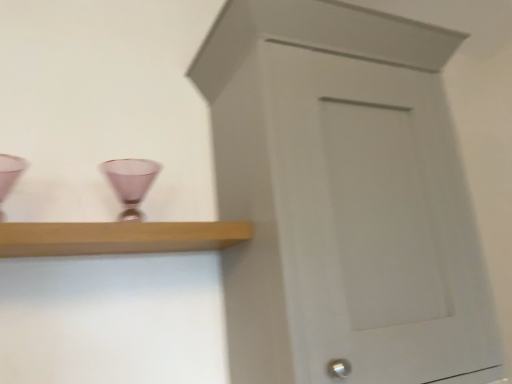
The height and width of the screenshot is (384, 512). Describe the element at coordinates (118, 237) in the screenshot. I see `light wood shelf at upper left` at that location.

I want to click on white painted wood cupboard at center, so point(343,198).

Locate an element on the screen. light wood shelf at upper left is located at coordinates (118, 237).

Is light wood shelf at upper left facing away from matte pink glass at center?

No, matte pink glass at center is not at the back of light wood shelf at upper left.

Considering the points (86, 229) and (112, 176), which point is behind, point (86, 229) or point (112, 176)?

The point (112, 176) is more distant.

Is light wood shelf at upper left located outside matte pink glass at center?

Yes.

How much distance is there between white painted wood cupboard at center and light wood shelf at upper left?

32.18 centimeters.

Consider the image. Which object is wider, white painted wood cupboard at center or light wood shelf at upper left?

Wider between the two is white painted wood cupboard at center.

Which of these two, white painted wood cupboard at center or light wood shelf at upper left, stands shorter?

Standing shorter between the two is light wood shelf at upper left.

Considering the positions of point (340, 334) and point (133, 252), is point (340, 334) closer or farther from the camera than point (133, 252)?

Point (340, 334).

From a real-world perspective, is light wood shelf at upper left positioned under white painted wood cupboard at center based on gravity?

Yes, from a real-world perspective, light wood shelf at upper left is under white painted wood cupboard at center.

Which of these two, light wood shelf at upper left or white painted wood cupboard at center, is wider?

white painted wood cupboard at center is wider.

Considering the relative positions of light wood shelf at upper left and white painted wood cupboard at center in the image provided, is light wood shelf at upper left to the right of white painted wood cupboard at center from the viewer's perspective?

No, light wood shelf at upper left is not to the right of white painted wood cupboard at center.

Between matte pink glass at center and light wood shelf at upper left, which one has smaller size?

matte pink glass at center.

Which object is closer to the camera, matte pink glass at center or light wood shelf at upper left?

light wood shelf at upper left is more forward.

Could light wood shelf at upper left be considered to be inside matte pink glass at center?

No, matte pink glass at center does not contain light wood shelf at upper left.

Are matte pink glass at center and light wood shelf at upper left beside each other?

No, matte pink glass at center is not touching light wood shelf at upper left.

From a real-world perspective, is white painted wood cupboard at center on top of matte pink glass at center?

No, from a real-world perspective, white painted wood cupboard at center is not on top of matte pink glass at center.

Which of these two, white painted wood cupboard at center or matte pink glass at center, is bigger?

With larger size is white painted wood cupboard at center.

Is matte pink glass at center at the back of white painted wood cupboard at center?

No, white painted wood cupboard at center's orientation is not away from matte pink glass at center.

Considering the sizes of objects white painted wood cupboard at center and matte pink glass at center in the image provided, who is taller, white painted wood cupboard at center or matte pink glass at center?

Standing taller between the two is white painted wood cupboard at center.

From a real-world perspective, relative to white painted wood cupboard at center, is matte pink glass at center vertically above or below?

matte pink glass at center is above white painted wood cupboard at center.

Which of these two, matte pink glass at center or white painted wood cupboard at center, stands shorter?

matte pink glass at center is shorter.

From the image's perspective, does matte pink glass at center appear higher than white painted wood cupboard at center?

Correct, matte pink glass at center appears higher than white painted wood cupboard at center in the image.

Locate an element on the screen. The image size is (512, 384). shelf lying in front of the matte pink glass at center is located at coordinates (118, 237).

Find the location of a particular element. shelf that is behind the white painted wood cupboard at center is located at coordinates 118,237.

From the image, which object appears to be nearer to light wood shelf at upper left, white painted wood cupboard at center or matte pink glass at center?

matte pink glass at center is closer to light wood shelf at upper left.

Looking at this image, when comparing their distances from matte pink glass at center, does white painted wood cupboard at center or light wood shelf at upper left seem further?

white painted wood cupboard at center lies further to matte pink glass at center than the other object.

Based on their spatial positions, is matte pink glass at center or white painted wood cupboard at center closer to light wood shelf at upper left?

matte pink glass at center is closer to light wood shelf at upper left.

In the scene shown: Based on their spatial positions, is light wood shelf at upper left or white painted wood cupboard at center closer to matte pink glass at center?

light wood shelf at upper left.

When comparing their distances from white painted wood cupboard at center, does matte pink glass at center or light wood shelf at upper left seem closer?

light wood shelf at upper left is positioned closer to the anchor white painted wood cupboard at center.

Based on their spatial positions, is light wood shelf at upper left or matte pink glass at center closer to white painted wood cupboard at center?

light wood shelf at upper left is positioned closer to the anchor white painted wood cupboard at center.

The image size is (512, 384). In order to click on shelf between matte pink glass at center and white painted wood cupboard at center from left to right in this screenshot , I will do coord(118,237).